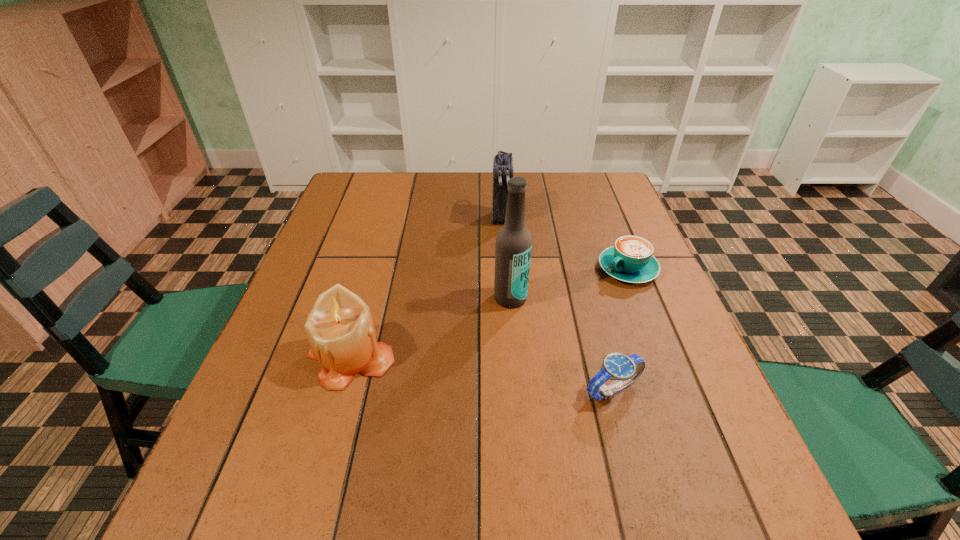
I want to click on free spot on the desktop that is between the leftmost object and the watch and is positioned with the zip open on the clutch bag, so click(x=497, y=376).

You are a GUI agent. You are given a task and a screenshot of the screen. Output one action in this format:
    pyautogui.click(x=<x>, y=<y>)
    Task: Click on the free space on the desktop that is between the candle and the watch and is positioned on the label of the tallest object
    The width and height of the screenshot is (960, 540).
    Given the screenshot: What is the action you would take?
    pyautogui.click(x=516, y=378)

What are the coordinates of `free space on the desktop that is between the candle and the watch and is positioned with the handle on the right side of the cappuccino` in the screenshot? It's located at (464, 372).